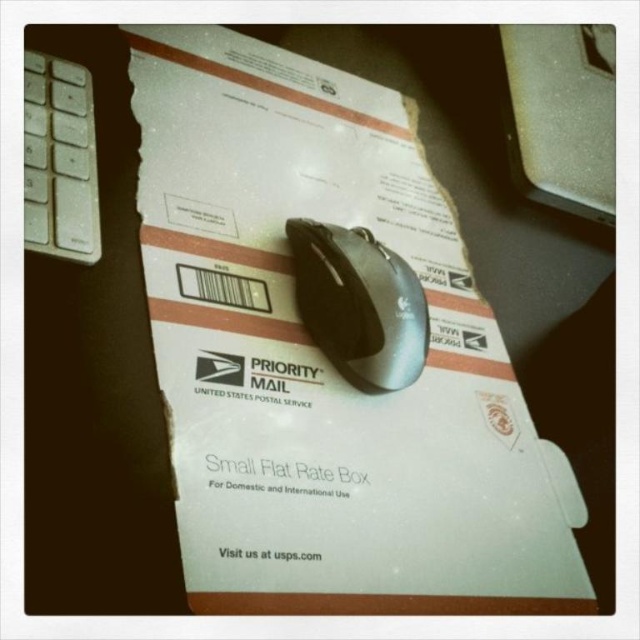
How distant is metallic silver computer at upper right from white plastic keyboard at left?

23.33 inches

Is metallic silver computer at upper right closer to camera compared to white plastic keyboard at left?

No.

Does point (529, 154) come closer to viewer compared to point (61, 83)?

No.

In order to click on metallic silver computer at upper right in this screenshot , I will do `click(561, 115)`.

Who is more forward, (570,204) or (301,272)?

Point (301,272) is more forward.

Does metallic silver computer at upper right come behind satin black mouse at center?

Yes, metallic silver computer at upper right is further from the viewer.

Locate an element on the screen. metallic silver computer at upper right is located at coordinates (561, 115).

Does satin black mouse at center have a greater width compared to white plastic keyboard at left?

Correct, the width of satin black mouse at center exceeds that of white plastic keyboard at left.

Does point (340, 241) lie behind point (36, 131)?

That is True.

I want to click on satin black mouse at center, so click(358, 304).